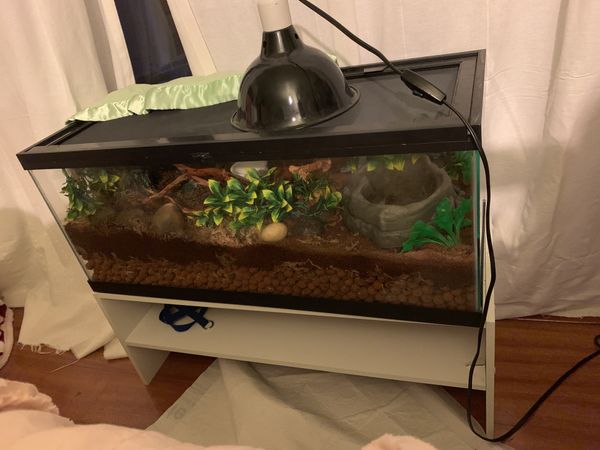
In order to click on floor in this screenshot , I will do `click(111, 397)`.